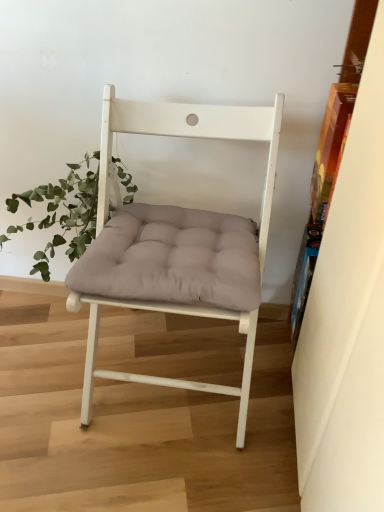
Question: From a real-world perspective, relative to wooden bookshelf at right, is matte white chair at center vertically above or below?

Choices:
 (A) above
 (B) below

Answer: (B)

Question: From the image's perspective, is matte white chair at center located above or below wooden bookshelf at right?

Choices:
 (A) below
 (B) above

Answer: (B)

Question: Which object is the farthest from the wooden bookshelf at right?

Choices:
 (A) green leafy plant at left
 (B) matte white chair at center

Answer: (A)

Question: Estimate the real-world distances between objects in this image. Which object is farther from the matte white chair at center?

Choices:
 (A) green leafy plant at left
 (B) wooden bookshelf at right

Answer: (B)